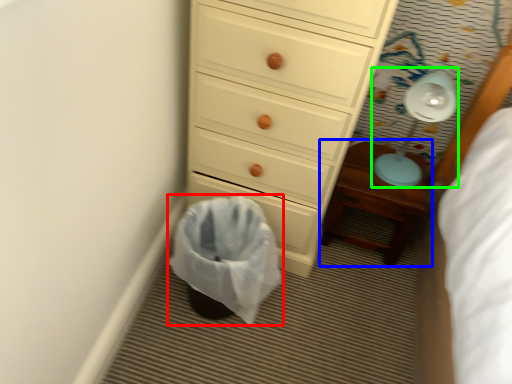
Question: Estimate the real-world distances between objects in this image. Which object is farther from laundry basket (highlighted by a red box), nightstand (highlighted by a blue box) or lamp (highlighted by a green box)?

Choices:
 (A) nightstand
 (B) lamp

Answer: (B)